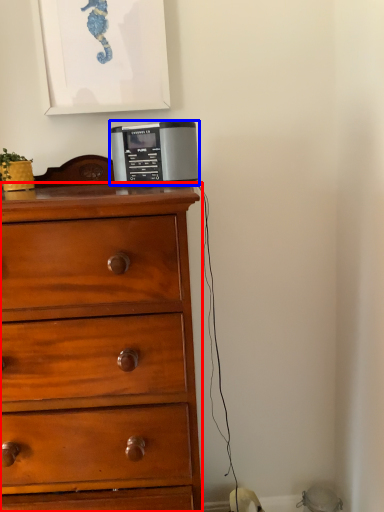
Question: Among these objects, which one is nearest to the camera, chest of drawers (highlighted by a red box) or home appliance (highlighted by a blue box)?

Choices:
 (A) chest of drawers
 (B) home appliance

Answer: (A)